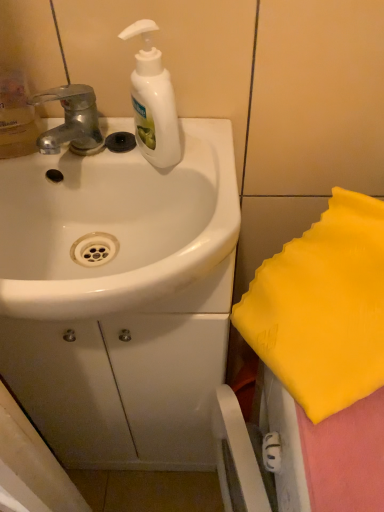
You are a GUI agent. You are given a task and a screenshot of the screen. Output one action in this format:
    pyautogui.click(x=<x>, y=<y>)
    Task: Click on the white glossy sink at center
    The width and height of the screenshot is (384, 512).
    Given the screenshot: What is the action you would take?
    pyautogui.click(x=115, y=225)

What is the approximate width of white glossy soap dispenser at upper center?

4.75 inches.

Identify the location of white glossy sink at center. This screenshot has height=512, width=384. (115, 225).

Can silver metallic faucet at upper left be found inside white glossy sink at center?

No, silver metallic faucet at upper left is located outside of white glossy sink at center.

Which of these two, white glossy sink at center or silver metallic faucet at upper left, is bigger?

Bigger between the two is white glossy sink at center.

From a real-world perspective, is white glossy sink at center positioned above or below silver metallic faucet at upper left?

In terms of real-world spatial position, white glossy sink at center is below silver metallic faucet at upper left.

Which object is positioned more to the right, silver metallic faucet at upper left or white glossy sink at center?

Positioned to the right is white glossy sink at center.

From a real-world perspective, who is located higher, silver metallic faucet at upper left or white glossy sink at center?

In real-world perspective, silver metallic faucet at upper left is above.

Does silver metallic faucet at upper left have a smaller size compared to white glossy sink at center?

Indeed, silver metallic faucet at upper left has a smaller size compared to white glossy sink at center.

From the image's perspective, would you say silver metallic faucet at upper left is positioned over white glossy sink at center?

Yes, from the image's perspective, silver metallic faucet at upper left is on top of white glossy sink at center.

In terms of height, does white glossy sink at center look taller or shorter compared to white glossy soap dispenser at upper center?

Considering their sizes, white glossy sink at center has less height than white glossy soap dispenser at upper center.

Which is in front, white glossy sink at center or white glossy soap dispenser at upper center?

white glossy sink at center is in front.

This screenshot has height=512, width=384. I want to click on sink located in front of the white glossy soap dispenser at upper center, so click(x=115, y=225).

Does point (151, 53) lie behind point (89, 104)?

No, it is not.

From a real-world perspective, is white glossy soap dispenser at upper center physically below silver metallic faucet at upper left?

No, from a real-world perspective, white glossy soap dispenser at upper center is not below silver metallic faucet at upper left.

Who is smaller, white glossy soap dispenser at upper center or silver metallic faucet at upper left?

Smaller between the two is silver metallic faucet at upper left.

Locate an element on the screen. tap directly beneath the white glossy soap dispenser at upper center (from a real-world perspective) is located at coordinates (72, 120).

Is white glossy soap dispenser at upper center taller or shorter than white glossy sink at center?

Clearly, white glossy soap dispenser at upper center is taller compared to white glossy sink at center.

Considering the sizes of white glossy soap dispenser at upper center and white glossy sink at center in the image, is white glossy soap dispenser at upper center bigger or smaller than white glossy sink at center?

In the image, white glossy soap dispenser at upper center appears to be smaller than white glossy sink at center.

Is white glossy soap dispenser at upper center aimed at white glossy sink at center?

No.

Considering the relative positions of silver metallic faucet at upper left and white glossy soap dispenser at upper center in the image provided, is silver metallic faucet at upper left in front of white glossy soap dispenser at upper center?

No, silver metallic faucet at upper left is behind white glossy soap dispenser at upper center.

Are silver metallic faucet at upper left and white glossy soap dispenser at upper center located far from each other?

silver metallic faucet at upper left is near white glossy soap dispenser at upper center, not far away.

Is point (58, 132) positioned in front of point (172, 128)?

No.

In the image, there is a white glossy soap dispenser at upper center. Where is `tap below it (from a real-world perspective)`? tap below it (from a real-world perspective) is located at coordinates (72, 120).

This screenshot has height=512, width=384. In the image, there is a silver metallic faucet at upper left. In order to click on sink below it (from a real-world perspective) in this screenshot , I will do `click(115, 225)`.

Find the location of a particular element. sink below the silver metallic faucet at upper left (from the image's perspective) is located at coordinates (115, 225).

When comparing their distances from white glossy soap dispenser at upper center, does silver metallic faucet at upper left or white glossy sink at center seem further?

Based on the image, white glossy sink at center appears to be further to white glossy soap dispenser at upper center.

Considering their positions, is white glossy soap dispenser at upper center positioned further to silver metallic faucet at upper left than white glossy sink at center?

Among the two, white glossy sink at center is located further to silver metallic faucet at upper left.

When comparing their distances from white glossy soap dispenser at upper center, does white glossy sink at center or silver metallic faucet at upper left seem further?

white glossy sink at center is positioned further to the anchor white glossy soap dispenser at upper center.

Considering their positions, is silver metallic faucet at upper left positioned closer to white glossy sink at center than white glossy soap dispenser at upper center?

white glossy soap dispenser at upper center.

Estimate the real-world distances between objects in this image. Which object is further from silver metallic faucet at upper left, white glossy sink at center or white glossy soap dispenser at upper center?

white glossy sink at center is positioned further to the anchor silver metallic faucet at upper left.

From the image, which object appears to be nearer to white glossy sink at center, white glossy soap dispenser at upper center or silver metallic faucet at upper left?

white glossy soap dispenser at upper center.

You are a GUI agent. You are given a task and a screenshot of the screen. Output one action in this format:
    pyautogui.click(x=<x>, y=<y>)
    Task: Click on the tap between white glossy soap dispenser at upper center and white glossy sink at center in the vertical direction
    
    Given the screenshot: What is the action you would take?
    pyautogui.click(x=72, y=120)